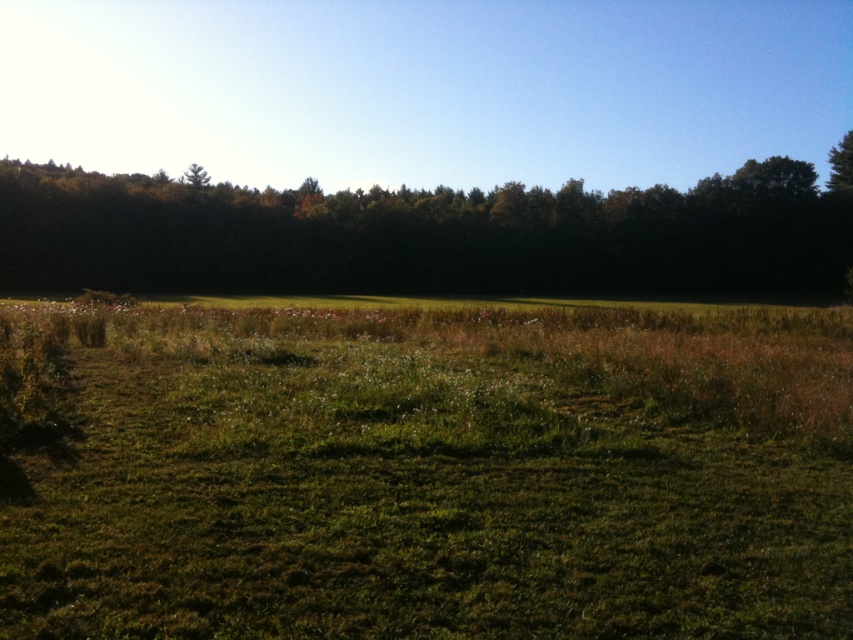
You are a farmer planning to plant crops in the green grassy field at center and the green leafy tree at upper center. Which area would you choose for planting crops, considering the space available?

The green grassy field at center is thinner than the green leafy tree at upper center, so the green grassy field at center has less space and may not be suitable for planting crops. The green leafy tree at upper center might be a better choice if it has enough space around it, but since trees typically occupy space themselves, the field is the intended area. However, based on the description, the field is thinner, implying it might be narrower or less spacious. Therefore, the farmer should consider the tree

You are a drone operator trying to capture a photo of the green grassy field at center and the green leafy tree at upper center. Which object should you focus on first if you want to ensure both are in the frame without moving the camera?

The green grassy field at center is smaller than the green leafy tree at upper center, so you should focus on the green leafy tree at upper center first to ensure both fit in the frame.